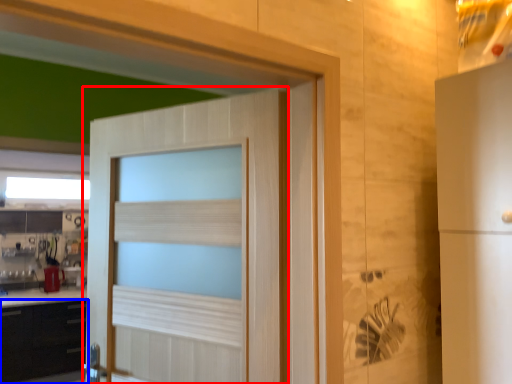
Question: Which object is closer to the camera taking this photo, door (highlighted by a red box) or cabinetry (highlighted by a blue box)?

Choices:
 (A) door
 (B) cabinetry

Answer: (A)